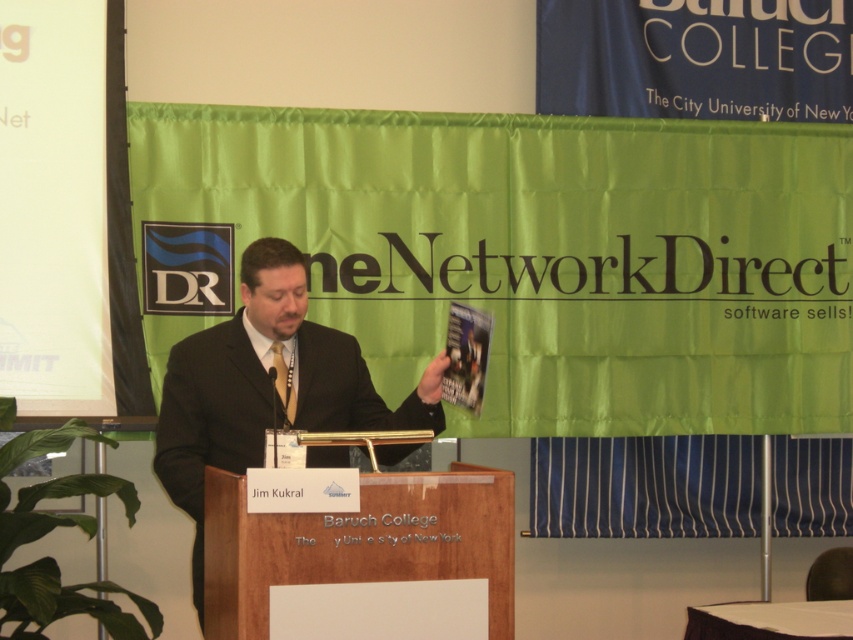
What do you see at coordinates (265, 387) in the screenshot? This screenshot has height=640, width=853. I see `black suit at center` at bounding box center [265, 387].

Does black suit at center appear over silky gold tie at center?

No.

Identify the location of black suit at center. (265, 387).

I want to click on black suit at center, so click(x=265, y=387).

Is point (200, 484) farther from viewer compared to point (318, 536)?

That is True.

From the picture: Can you confirm if black suit at center is smaller than wooden podium at center?

No.

What do you see at coordinates (265, 387) in the screenshot?
I see `black suit at center` at bounding box center [265, 387].

You are a GUI agent. You are given a task and a screenshot of the screen. Output one action in this format:
    pyautogui.click(x=<x>, y=<y>)
    Task: Click on the black suit at center
    The width and height of the screenshot is (853, 640).
    Given the screenshot: What is the action you would take?
    pyautogui.click(x=265, y=387)

Which of these two, wooden podium at center or silky gold tie at center, stands shorter?

With less height is silky gold tie at center.

Can you confirm if wooden podium at center is shorter than silky gold tie at center?

Incorrect, wooden podium at center's height does not fall short of silky gold tie at center's.

Describe the element at coordinates (357, 545) in the screenshot. The height and width of the screenshot is (640, 853). I see `wooden podium at center` at that location.

I want to click on wooden podium at center, so click(x=357, y=545).